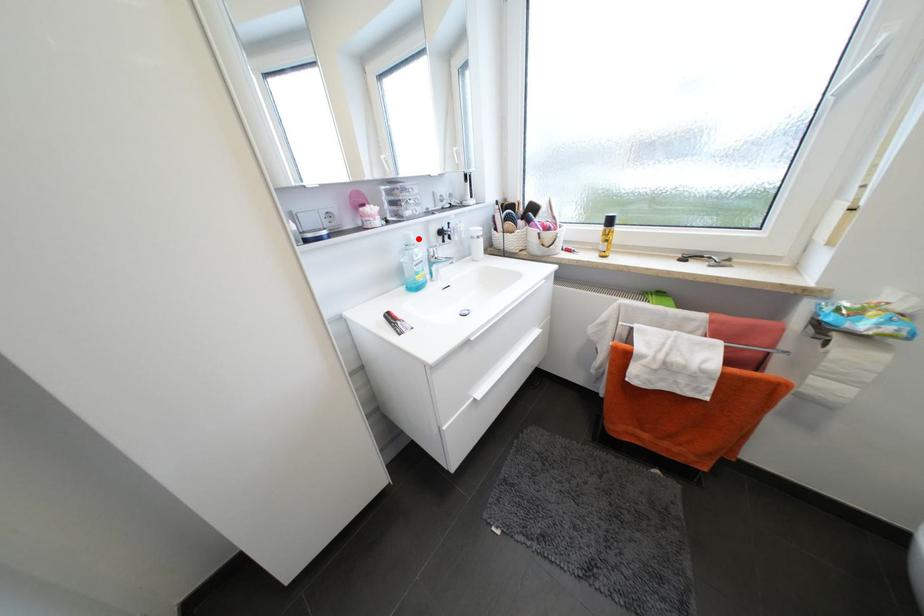
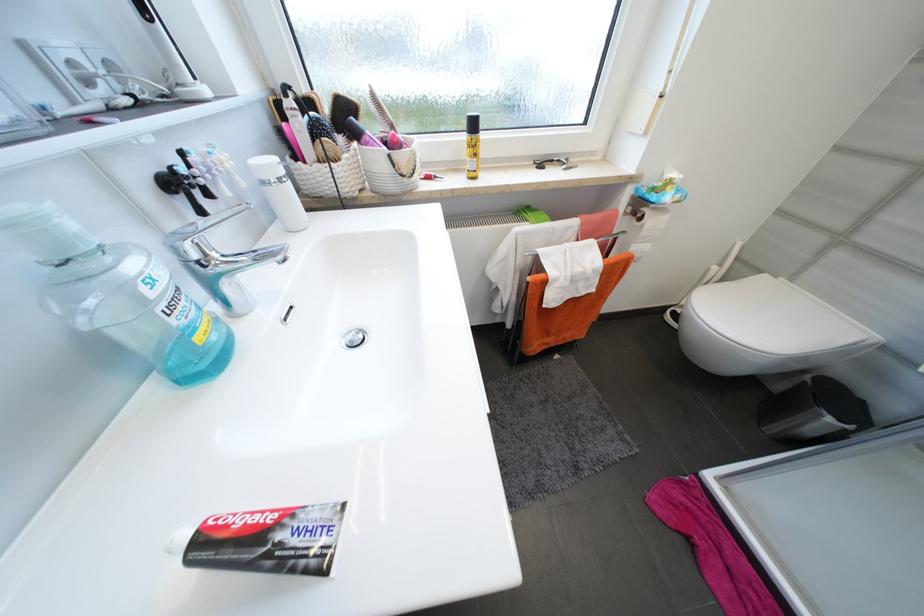
Find the pixel in the second image that matches the highlighted location in the first image.

(78, 227)